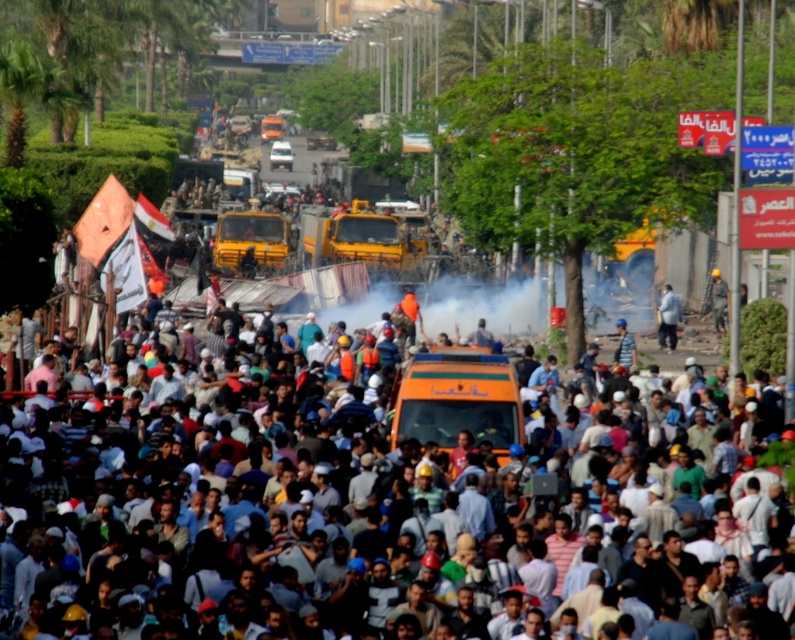
You are a photographer trying to capture a detailed shot of the light blue fabric shirt at center. Given that the orange fabric crowd at center is blocking your view, can you estimate whether the crowd is bigger than the shirt in size?

The orange fabric crowd at center has a larger size compared to the light blue fabric shirt at center, so the crowd is bigger than the shirt, making it harder to see the shirt through the crowd.

You are a drone operator trying to capture footage of the white dusty smoke at center from a safe distance. The drone has a maximum operational range of 150 feet. Can you safely capture the footage without exceeding the drone limit?

The white dusty smoke at center is 170.18 feet away from the viewer. Since the drone can only operate up to 150 feet, it cannot safely capture the footage without exceeding its operational range.

You are a photographer standing at the back of the scene. You want to take a clear photo of both the orange fabric crowd at center and the light blue fabric shirt at center. Which object will appear larger in your photo?

The orange fabric crowd at center will appear larger in the photo because it is closer to the viewer than the light blue fabric shirt at center.